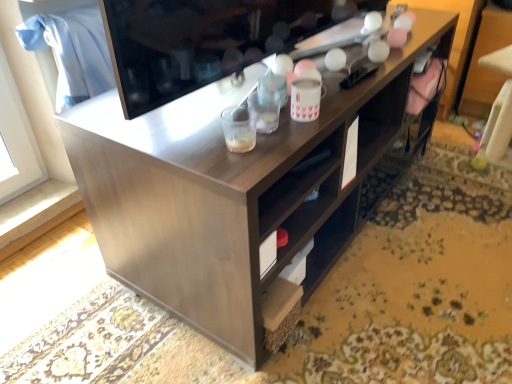
What are the coordinates of `vacant area in front of white ceramic mug at upper center, which is the first beverage in right-to-left order` in the screenshot? It's located at (286, 141).